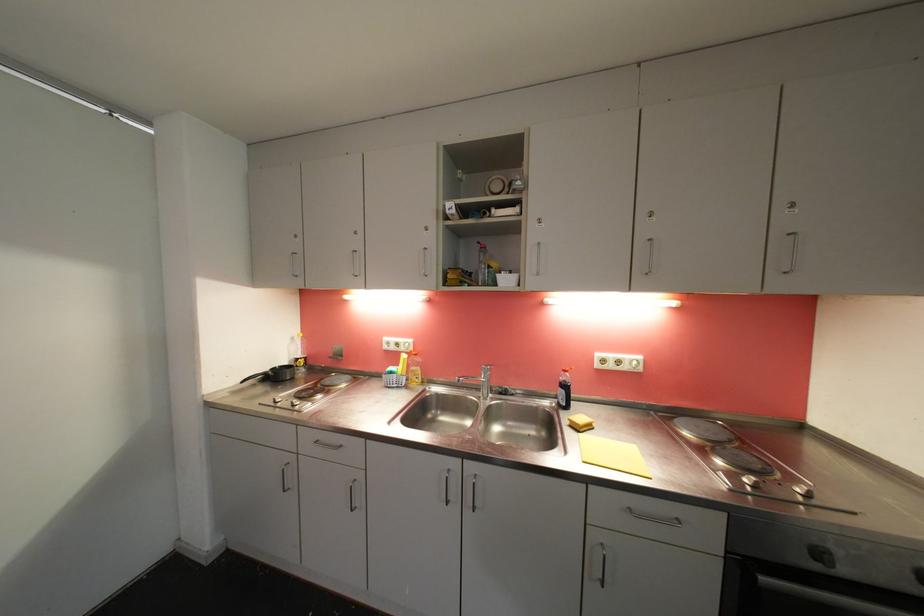
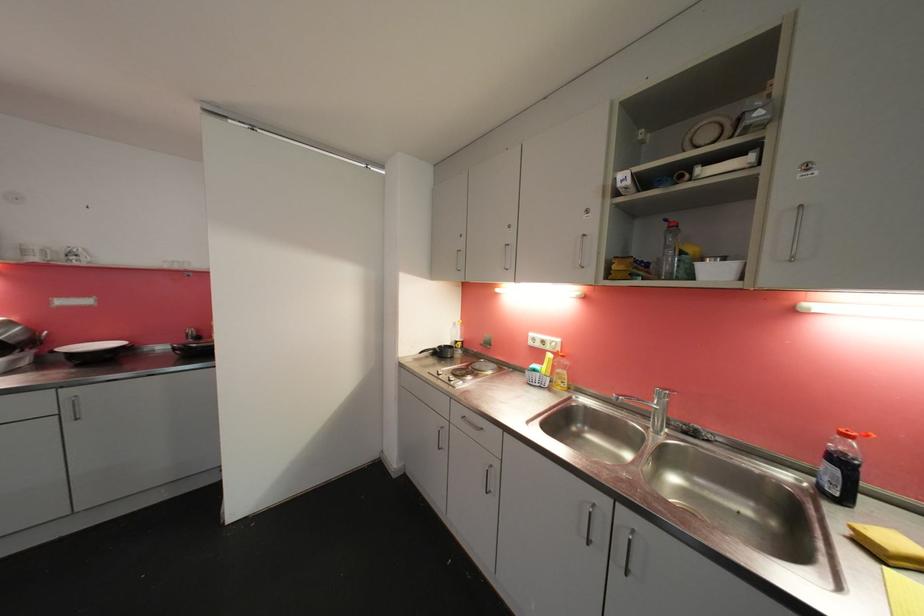
Where in the second image is the point corresponding to pixel 395 375 from the first image?

(540, 373)